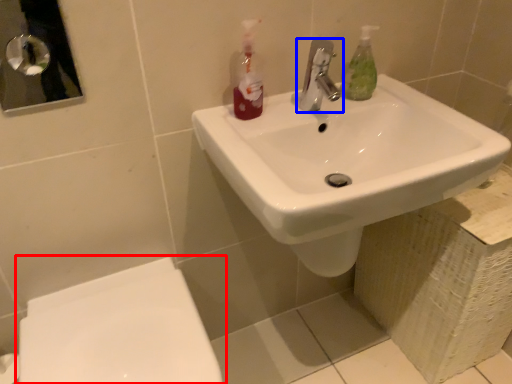
Question: Among these objects, which one is farthest to the camera, toilet (highlighted by a red box) or tap (highlighted by a blue box)?

Choices:
 (A) toilet
 (B) tap

Answer: (B)